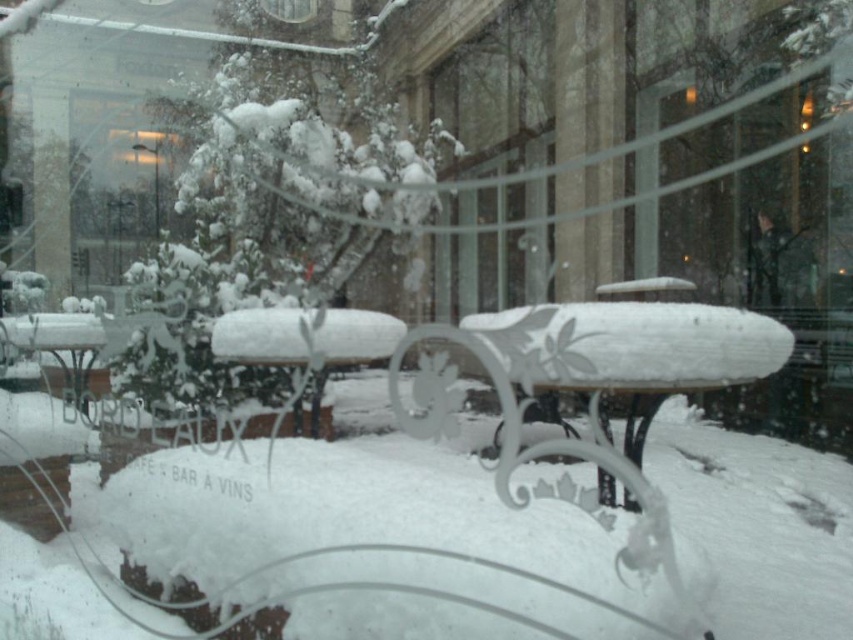
Question: Considering the relative positions of white frosted glass table at center and white frosted table at center in the image provided, where is white frosted glass table at center located with respect to white frosted table at center?

Choices:
 (A) above
 (B) below

Answer: (B)

Question: Is white frosted glass table at center thinner than white frosted table at center?

Choices:
 (A) yes
 (B) no

Answer: (B)

Question: Which object is farther from the camera taking this photo?

Choices:
 (A) white frosted glass table at center
 (B) white frosted table at center

Answer: (B)

Question: Among these points, which one is nearest to the camera?

Choices:
 (A) (741, 355)
 (B) (357, 348)

Answer: (A)

Question: Is white frosted glass table at center smaller than white frosted table at center?

Choices:
 (A) no
 (B) yes

Answer: (B)